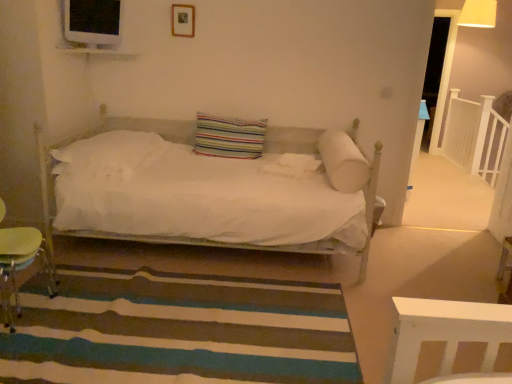
The width and height of the screenshot is (512, 384). What are the coordinates of `vacant area that lies to the right of green plastic swivel chair at lower left` in the screenshot? It's located at (79, 316).